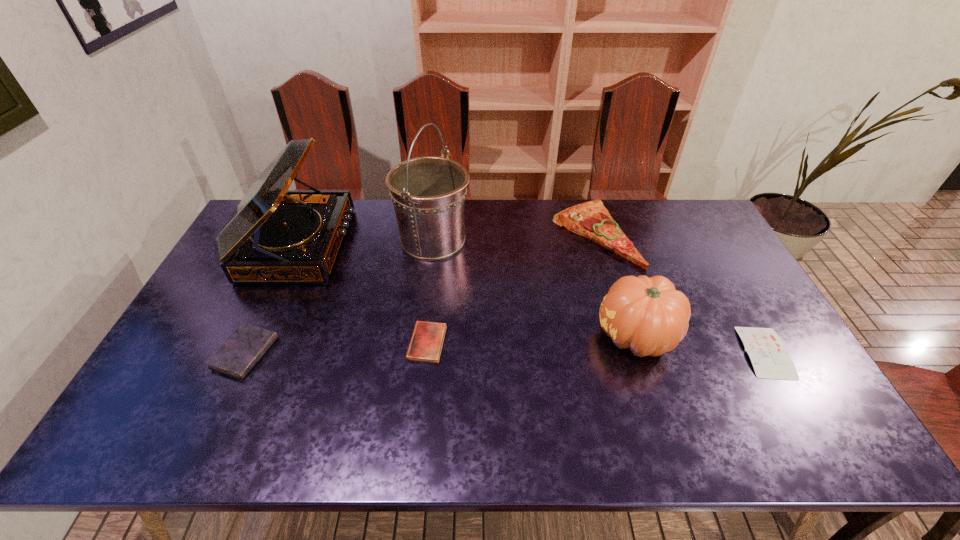
I want to click on vacant point located on the right of the bucket, so click(x=538, y=240).

Find the location of a particular element. The width and height of the screenshot is (960, 540). free location located 0.240m on the front-facing side of the second tallest object is located at coordinates (418, 245).

Where is `vacant region located on the carved face of the fifth shortest object`? The image size is (960, 540). vacant region located on the carved face of the fifth shortest object is located at coordinates (475, 336).

Where is `free location located on the carved face of the fifth shortest object`? The height and width of the screenshot is (540, 960). free location located on the carved face of the fifth shortest object is located at coordinates (483, 336).

Find the location of a particular element. vacant area located 0.260m on the carved face of the fifth shortest object is located at coordinates (501, 336).

Image resolution: width=960 pixels, height=540 pixels. Identify the location of free location located on the front of the pizza. (632, 359).

This screenshot has width=960, height=540. Find the location of `vacant space located 0.370m on the right of the third shortest object`. vacant space located 0.370m on the right of the third shortest object is located at coordinates (412, 353).

Identify the location of free space located on the left of the second diary from left to right. (368, 343).

Image resolution: width=960 pixels, height=540 pixels. What are the coordinates of `free location located on the left of the shortest object` in the screenshot? It's located at (x=664, y=352).

Locate an element on the screen. This screenshot has height=540, width=960. bucket that is at the far edge is located at coordinates (428, 193).